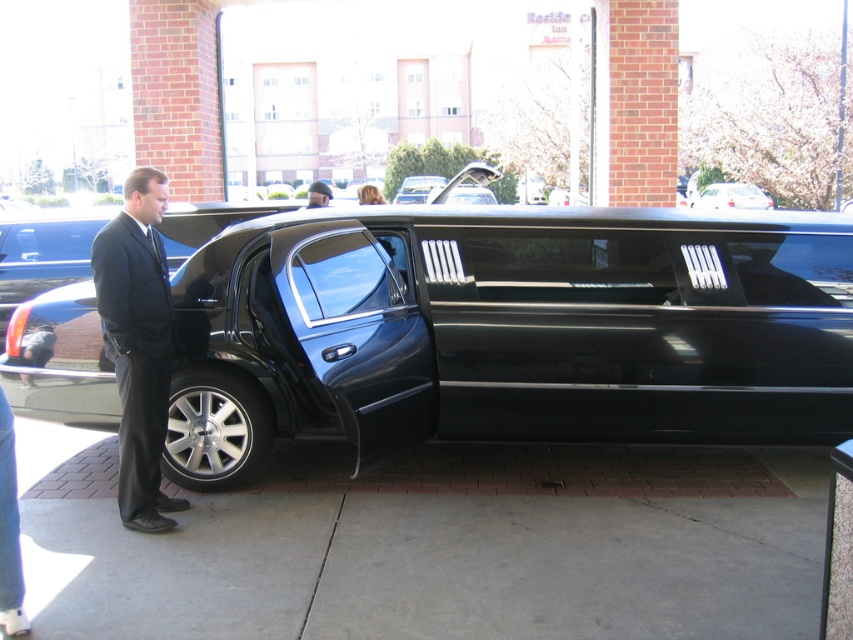
Question: Which object is the closest to the dark blue suit at center?

Choices:
 (A) black glossy limousine at center
 (B) metallic silver sedan at center
 (C) matte black suit at center

Answer: (A)

Question: Considering the real-world distances, which object is farthest from the matte black suit at center?

Choices:
 (A) black glossy limousine at center
 (B) metallic silver sedan at center

Answer: (B)

Question: Which object is closer to the camera taking this photo?

Choices:
 (A) black glossy limousine at center
 (B) matte black suit at center
 (C) dark blue suit at center

Answer: (B)

Question: Where is matte black suit at center located in relation to dark blue suit at center in the image?

Choices:
 (A) above
 (B) below

Answer: (B)

Question: Can you confirm if matte black suit at center is smaller than dark blue suit at center?

Choices:
 (A) no
 (B) yes

Answer: (B)

Question: Can you confirm if black glossy limousine at center is smaller than dark blue suit at center?

Choices:
 (A) yes
 (B) no

Answer: (A)